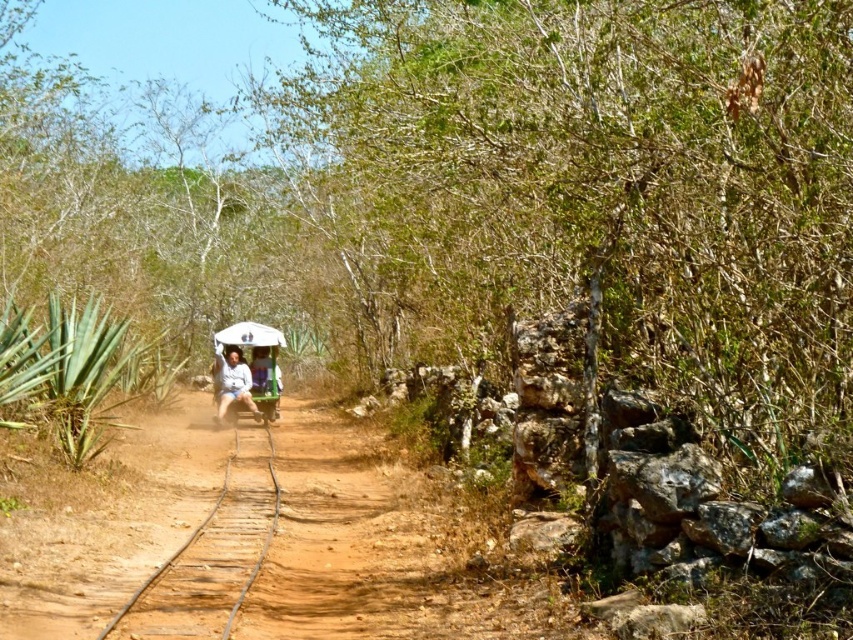
Question: In this image, where is light blue fabric umbrella at center located relative to white matte umbrella at center?

Choices:
 (A) below
 (B) above

Answer: (A)

Question: Is light blue fabric umbrella at center wider than white matte umbrella at center?

Choices:
 (A) yes
 (B) no

Answer: (B)

Question: Which of the following is the closest to the observer?

Choices:
 (A) light blue fabric umbrella at center
 (B) white matte umbrella at center

Answer: (A)

Question: Among these objects, which one is farthest from the camera?

Choices:
 (A) brown wooden train track at center
 (B) white matte umbrella at center
 (C) light blue fabric umbrella at center

Answer: (B)

Question: Which object is closer to the camera taking this photo?

Choices:
 (A) white matte umbrella at center
 (B) light blue fabric umbrella at center

Answer: (B)

Question: Does brown wooden train track at center lie in front of light blue fabric umbrella at center?

Choices:
 (A) no
 (B) yes

Answer: (B)